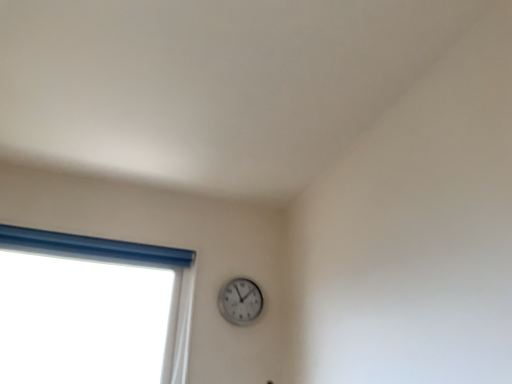
Question: Is white plastic window at left closer to camera compared to white plastic wall clock at upper center?

Choices:
 (A) yes
 (B) no

Answer: (A)

Question: Does white plastic window at left turn towards white plastic wall clock at upper center?

Choices:
 (A) yes
 (B) no

Answer: (B)

Question: Is white plastic window at left taller than white plastic wall clock at upper center?

Choices:
 (A) yes
 (B) no

Answer: (A)

Question: Is the position of white plastic window at left more distant than that of white plastic wall clock at upper center?

Choices:
 (A) yes
 (B) no

Answer: (B)

Question: From a real-world perspective, is white plastic window at left below white plastic wall clock at upper center?

Choices:
 (A) no
 (B) yes

Answer: (B)

Question: Considering the relative sizes of white plastic window at left and white plastic wall clock at upper center in the image provided, is white plastic window at left smaller than white plastic wall clock at upper center?

Choices:
 (A) yes
 (B) no

Answer: (B)

Question: Considering the relative sizes of white plastic wall clock at upper center and white plastic window at left in the image provided, is white plastic wall clock at upper center bigger than white plastic window at left?

Choices:
 (A) no
 (B) yes

Answer: (A)

Question: Is white plastic wall clock at upper center placed right next to white plastic window at left?

Choices:
 (A) no
 (B) yes

Answer: (A)

Question: Is there a large distance between white plastic wall clock at upper center and white plastic window at left?

Choices:
 (A) no
 (B) yes

Answer: (A)

Question: Is white plastic wall clock at upper center further to camera compared to white plastic window at left?

Choices:
 (A) no
 (B) yes

Answer: (B)

Question: Is white plastic wall clock at upper center smaller than white plastic window at left?

Choices:
 (A) yes
 (B) no

Answer: (A)

Question: Does white plastic wall clock at upper center have a lesser height compared to white plastic window at left?

Choices:
 (A) yes
 (B) no

Answer: (A)

Question: Does point (181, 324) appear closer or farther from the camera than point (220, 294)?

Choices:
 (A) closer
 (B) farther

Answer: (A)